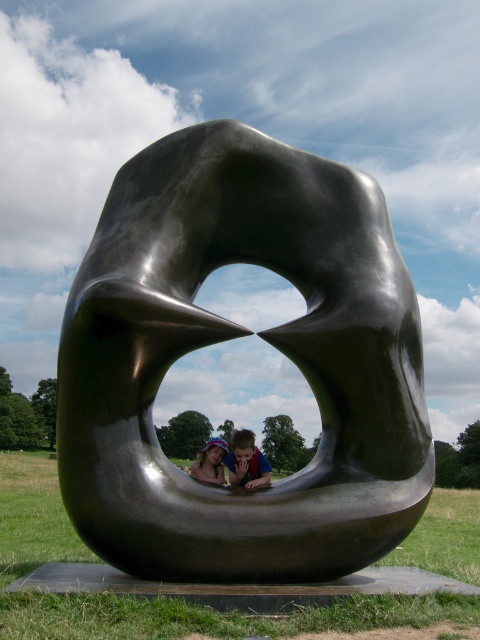
In the scene shown: You are standing in the field and see the shiny dark green sculpture at center and the blue fabric face at center. Which object is positioned to the left?

The blue fabric face at center is to the left of the shiny dark green sculpture at center.

You are a photographer trying to capture a photo of both the shiny dark green sculpture at center and the blue fabric face at center in the same frame. The camera you are using has a minimum focusing distance of 2 meters. Will you be able to take the photo without moving either object?

The shiny dark green sculpture at center and blue fabric face at center are 1.95 meters apart from each other. Since the minimum focusing distance of the camera is 2 meters, the photographer cannot capture both objects in the same frame without moving them closer together.

You are standing in a grassy field and want to take a photo of yourself with the shiny dark green sculpture at center. If you are currently 5 meters away from the sculpture, should you move closer or farther away to be exactly at the correct distance for the photo?

The shiny dark green sculpture at center is 5.36 meters from the camera. Since you are currently 5 meters away, you need to move 0.36 meters farther away to reach the correct distance of 5.36 meters.